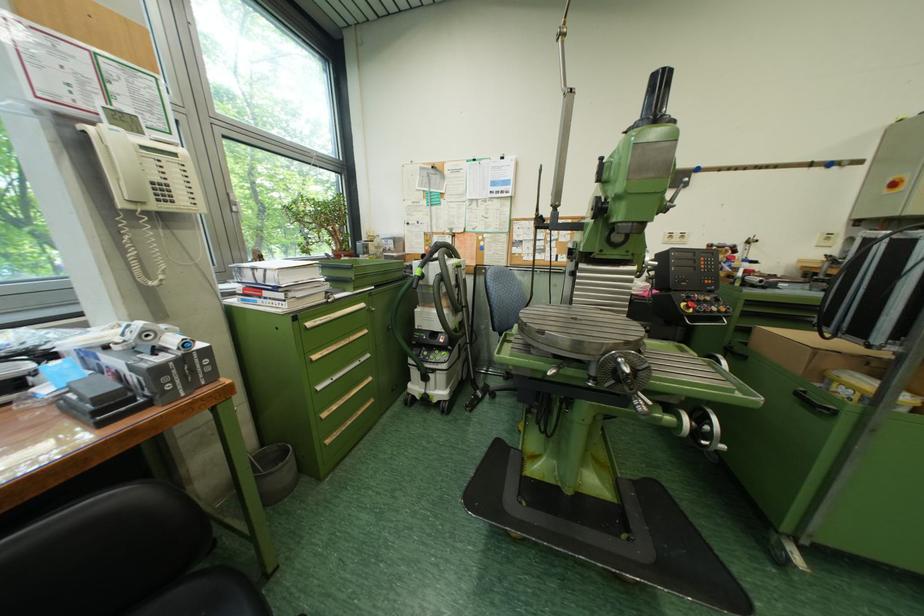
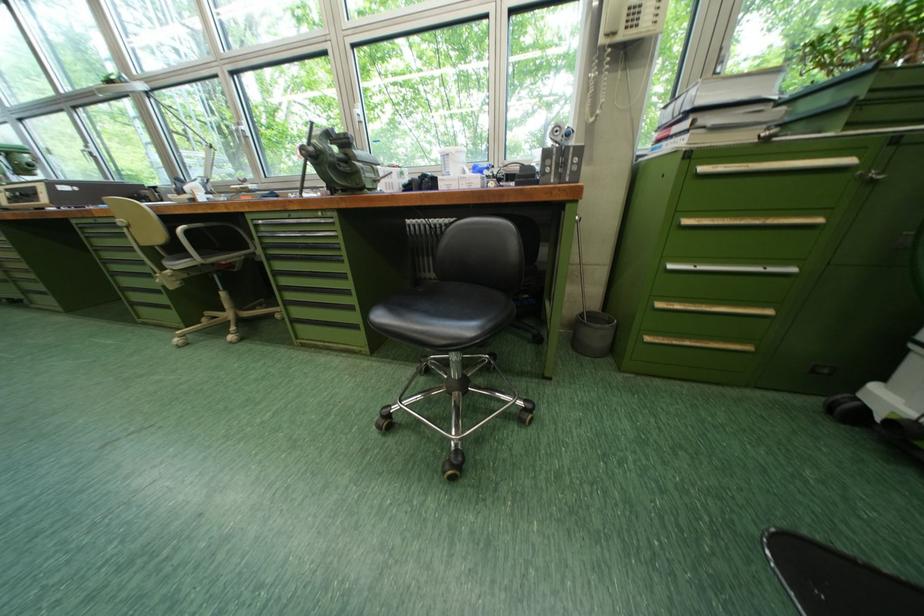
Locate, in the second image, the point that corresponds to the point at 320,326 in the first image.

(713, 169)